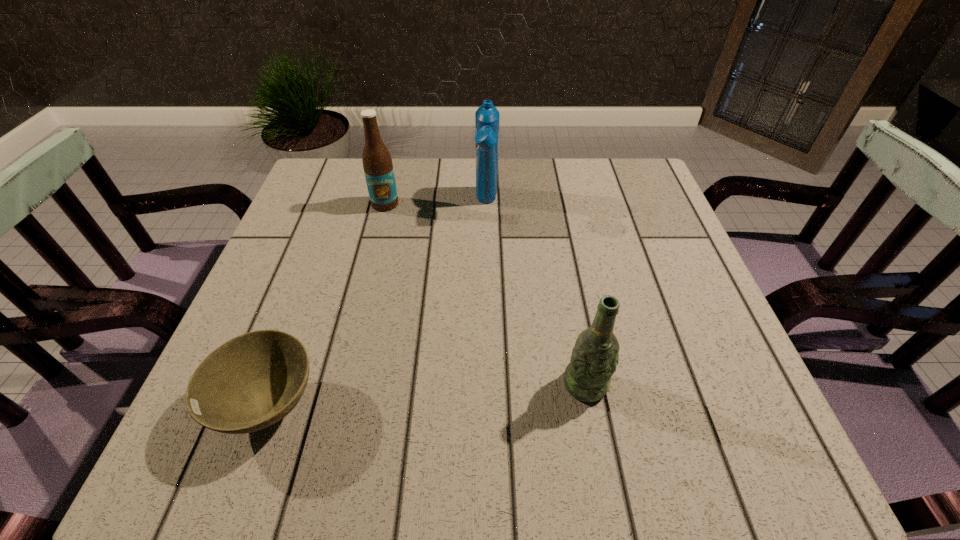
Locate an element on the screen. Image resolution: width=960 pixels, height=540 pixels. vacant region at the far right corner of the desktop is located at coordinates (618, 167).

At what (x,y) coordinates should I click in order to perform the action: click on free space at the near right corner of the desktop. Please return your answer as a coordinate pair (x, y). Looking at the image, I should click on (746, 452).

At what (x,y) coordinates should I click in order to perform the action: click on free point between the rightmost object and the shortest object. Please return your answer as a coordinate pair (x, y). Image resolution: width=960 pixels, height=540 pixels. Looking at the image, I should click on (427, 395).

The width and height of the screenshot is (960, 540). I want to click on empty location between the third object from left to right and the bowl, so tap(378, 304).

Identify the location of vacant space in between the left beer bottle and the shortest object. This screenshot has height=540, width=960. (327, 305).

Where is `blank region between the bowl and the rightmost object`? The image size is (960, 540). blank region between the bowl and the rightmost object is located at coordinates (x=427, y=395).

Where is `blank region between the right beer bottle and the shampoo`? The image size is (960, 540). blank region between the right beer bottle and the shampoo is located at coordinates (536, 294).

Identify the location of free spot between the bowl and the shampoo. (378, 304).

At what (x,y) coordinates should I click in order to perform the action: click on free space between the shortest object and the left beer bottle. Please return your answer as a coordinate pair (x, y). Looking at the image, I should click on (327, 305).

I want to click on vacant space that's between the shortest object and the third object from left to right, so click(x=378, y=304).